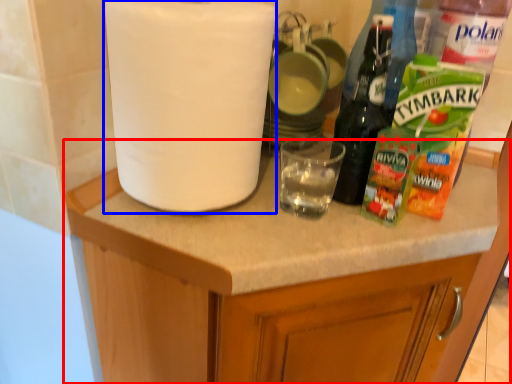
Question: Which of the following is the closest to the observer, cabinetry (highlighted by a red box) or paper towel (highlighted by a blue box)?

Choices:
 (A) cabinetry
 (B) paper towel

Answer: (A)